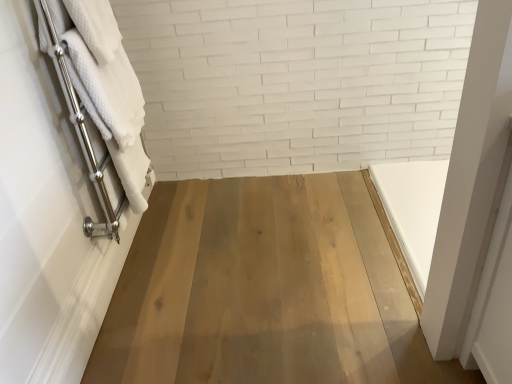
Image resolution: width=512 pixels, height=384 pixels. In order to click on white textured towel at left, the 1th bath towel positioned from the bottom in this screenshot , I will do `click(106, 92)`.

Describe the element at coordinates (106, 92) in the screenshot. This screenshot has width=512, height=384. I see `white textured towel at left, placed as the second bath towel when sorted from top to bottom` at that location.

The height and width of the screenshot is (384, 512). What are the coordinates of `white textured towel at left, which appears as the 2th bath towel when ordered from the bottom` in the screenshot? It's located at (106, 90).

Describe the element at coordinates (106, 90) in the screenshot. Image resolution: width=512 pixels, height=384 pixels. I see `white textured towel at left, which appears as the 2th bath towel when ordered from the bottom` at that location.

Locate an element on the screen. white textured towel at left, the 1th bath towel positioned from the bottom is located at coordinates (106, 92).

Considering the relative positions of white textured towel at left, the 1th bath towel positioned from the bottom, and white textured towel at left, acting as the first bath towel starting from the top, in the image provided, is white textured towel at left, the 1th bath towel positioned from the bottom, to the left of white textured towel at left, acting as the first bath towel starting from the top, from the viewer's perspective?

Indeed, white textured towel at left, the 1th bath towel positioned from the bottom, is positioned on the left side of white textured towel at left, acting as the first bath towel starting from the top.

Is white textured towel at left, the 1th bath towel positioned from the bottom, positioned in front of white textured towel at left, acting as the first bath towel starting from the top?

Yes, white textured towel at left, the 1th bath towel positioned from the bottom, is closer to the viewer.

Between point (89, 107) and point (70, 60), which one is positioned in front?

Point (70, 60)

From the image's perspective, is white textured towel at left, placed as the second bath towel when sorted from top to bottom, located above white textured towel at left, which appears as the 2th bath towel when ordered from the bottom?

No, from the image's perspective, white textured towel at left, placed as the second bath towel when sorted from top to bottom, is not on top of white textured towel at left, which appears as the 2th bath towel when ordered from the bottom.

From a real-world perspective, which object rests below the other?

white textured towel at left, placed as the second bath towel when sorted from top to bottom.

Based on the photo, considering the sizes of white textured towel at left, the 1th bath towel positioned from the bottom, and white textured towel at left, acting as the first bath towel starting from the top, in the image, is white textured towel at left, the 1th bath towel positioned from the bottom, wider or thinner than white textured towel at left, acting as the first bath towel starting from the top,?

In the image, white textured towel at left, the 1th bath towel positioned from the bottom, appears to be more narrow than white textured towel at left, acting as the first bath towel starting from the top.

Considering the relative sizes of white textured towel at left, placed as the second bath towel when sorted from top to bottom, and white textured towel at left, which appears as the 2th bath towel when ordered from the bottom, in the image provided, is white textured towel at left, placed as the second bath towel when sorted from top to bottom, taller than white textured towel at left, which appears as the 2th bath towel when ordered from the bottom,?

Yes, white textured towel at left, placed as the second bath towel when sorted from top to bottom, is taller than white textured towel at left, which appears as the 2th bath towel when ordered from the bottom.

Considering the sizes of objects white textured towel at left, placed as the second bath towel when sorted from top to bottom, and white textured towel at left, acting as the first bath towel starting from the top, in the image provided, who is bigger, white textured towel at left, placed as the second bath towel when sorted from top to bottom, or white textured towel at left, acting as the first bath towel starting from the top,?

white textured towel at left, placed as the second bath towel when sorted from top to bottom, is bigger.

Is white textured towel at left, the 1th bath towel positioned from the bottom, spatially inside white textured towel at left, acting as the first bath towel starting from the top, or outside of it?

white textured towel at left, the 1th bath towel positioned from the bottom, is outside white textured towel at left, acting as the first bath towel starting from the top.

Are white textured towel at left, the 1th bath towel positioned from the bottom, and white textured towel at left, acting as the first bath towel starting from the top, making contact?

Yes, white textured towel at left, the 1th bath towel positioned from the bottom, is with white textured towel at left, acting as the first bath towel starting from the top.

Is white textured towel at left, the 1th bath towel positioned from the bottom, positioned with its back to white textured towel at left, which appears as the 2th bath towel when ordered from the bottom?

Yes, white textured towel at left, the 1th bath towel positioned from the bottom, is positioned with its back facing white textured towel at left, which appears as the 2th bath towel when ordered from the bottom.

Identify the location of bath towel on the right of white textured towel at left, placed as the second bath towel when sorted from top to bottom. (106, 90).

Is white textured towel at left, acting as the first bath towel starting from the top, at the left side of white textured towel at left, placed as the second bath towel when sorted from top to bottom?

Incorrect, white textured towel at left, acting as the first bath towel starting from the top, is not on the left side of white textured towel at left, placed as the second bath towel when sorted from top to bottom.

Does white textured towel at left, acting as the first bath towel starting from the top, lie in front of white textured towel at left, the 1th bath towel positioned from the bottom?

No, white textured towel at left, acting as the first bath towel starting from the top, is further to the viewer.

Which is less distant, (x=106, y=138) or (x=121, y=167)?

Point (x=106, y=138).

From the image's perspective, is white textured towel at left, which appears as the 2th bath towel when ordered from the bottom, on white textured towel at left, placed as the second bath towel when sorted from top to bottom?

Indeed, from the image's perspective, white textured towel at left, which appears as the 2th bath towel when ordered from the bottom, is shown above white textured towel at left, placed as the second bath towel when sorted from top to bottom.

From the picture: From a real-world perspective, who is located lower, white textured towel at left, acting as the first bath towel starting from the top, or white textured towel at left, the 1th bath towel positioned from the bottom?

white textured towel at left, the 1th bath towel positioned from the bottom, from a real-world perspective.

Is white textured towel at left, which appears as the 2th bath towel when ordered from the bottom, thinner than white textured towel at left, placed as the second bath towel when sorted from top to bottom?

Incorrect, the width of white textured towel at left, which appears as the 2th bath towel when ordered from the bottom, is not less than that of white textured towel at left, placed as the second bath towel when sorted from top to bottom.

Can you confirm if white textured towel at left, which appears as the 2th bath towel when ordered from the bottom, is shorter than white textured towel at left, placed as the second bath towel when sorted from top to bottom?

Correct, white textured towel at left, which appears as the 2th bath towel when ordered from the bottom, is not as tall as white textured towel at left, placed as the second bath towel when sorted from top to bottom.

Does white textured towel at left, which appears as the 2th bath towel when ordered from the bottom, have a larger size compared to white textured towel at left, placed as the second bath towel when sorted from top to bottom?

No, white textured towel at left, which appears as the 2th bath towel when ordered from the bottom, is not bigger than white textured towel at left, placed as the second bath towel when sorted from top to bottom.

Can white textured towel at left, the 1th bath towel positioned from the bottom, be found inside white textured towel at left, acting as the first bath towel starting from the top?

No, white textured towel at left, the 1th bath towel positioned from the bottom, is not surrounded by white textured towel at left, acting as the first bath towel starting from the top.

Is white textured towel at left, acting as the first bath towel starting from the top, placed right next to white textured towel at left, placed as the second bath towel when sorted from top to bottom?

Yes, white textured towel at left, acting as the first bath towel starting from the top, is right next to white textured towel at left, placed as the second bath towel when sorted from top to bottom, and making contact.

Does white textured towel at left, which appears as the 2th bath towel when ordered from the bottom, turn towards white textured towel at left, placed as the second bath towel when sorted from top to bottom?

Yes, white textured towel at left, which appears as the 2th bath towel when ordered from the bottom, is facing white textured towel at left, placed as the second bath towel when sorted from top to bottom.

Where is `bath towel in front of the white textured towel at left, acting as the first bath towel starting from the top`? This screenshot has height=384, width=512. bath towel in front of the white textured towel at left, acting as the first bath towel starting from the top is located at coordinates (106, 92).

The width and height of the screenshot is (512, 384). What are the coordinates of `bath towel lying below the white textured towel at left, acting as the first bath towel starting from the top (from the image's perspective)` in the screenshot? It's located at (106, 92).

Locate an element on the screen. The width and height of the screenshot is (512, 384). bath towel on the right of the white textured towel at left, the 1th bath towel positioned from the bottom is located at coordinates (106, 90).